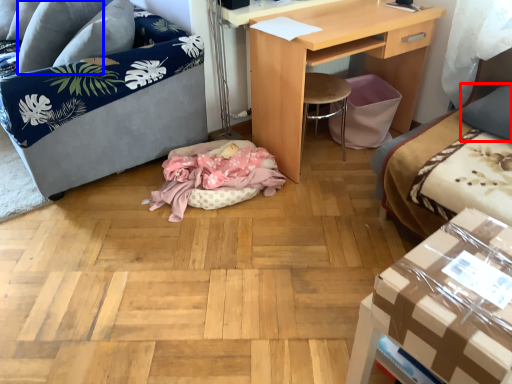
Question: Which object is further to the camera taking this photo, pillow (highlighted by a red box) or pillow (highlighted by a blue box)?

Choices:
 (A) pillow
 (B) pillow

Answer: (B)